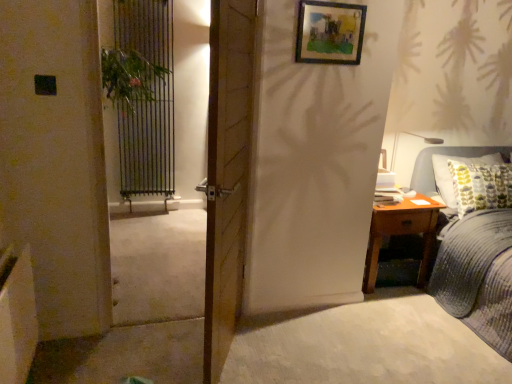
Question: Is green leafy plant at left to the left or to the right of wooden door at center in the image?

Choices:
 (A) right
 (B) left

Answer: (B)

Question: From a real-world perspective, relative to wooden door at center, is green leafy plant at left vertically above or below?

Choices:
 (A) above
 (B) below

Answer: (A)

Question: Based on their relative distances, which object is farther from the green leafy plant at left?

Choices:
 (A) matte gray table lamp at right
 (B) wooden framed artwork at upper center
 (C) brown wooden nightstand at right
 (D) green leafy plant at left
 (E) wooden door at center

Answer: (C)

Question: Considering the real-world distances, which object is closest to the green leafy plant at left?

Choices:
 (A) green leafy plant at left
 (B) matte gray table lamp at right
 (C) blue corduroy bed at right
 (D) brown wooden nightstand at right
 (E) wooden framed artwork at upper center

Answer: (A)